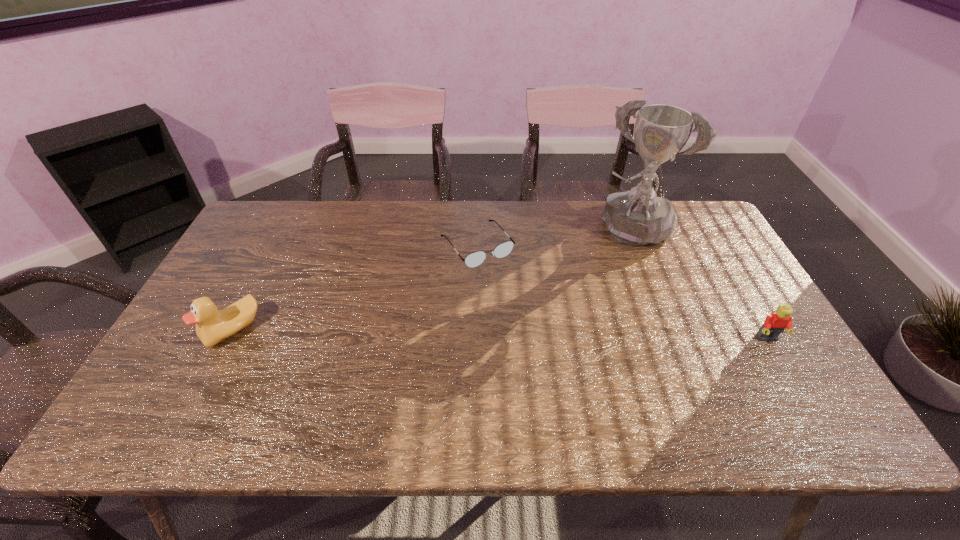
Find the location of a particular element. Image resolution: width=960 pixels, height=540 pixels. duck is located at coordinates (212, 326).

The image size is (960, 540). What are the coordinates of `the rightmost object` in the screenshot? It's located at (774, 324).

What are the coordinates of `spectacles` in the screenshot? It's located at (502, 250).

Where is `the third object from right to left`? the third object from right to left is located at coordinates (502, 250).

Find the location of a particular element. This screenshot has height=540, width=960. award is located at coordinates (638, 217).

In order to click on the tallest object in this screenshot , I will do `click(638, 217)`.

Locate an element on the screen. The image size is (960, 540). free space located 0.150m on the face of the Lego is located at coordinates (803, 399).

Where is `vacant area situated on the lenses of the spectacles`? The height and width of the screenshot is (540, 960). vacant area situated on the lenses of the spectacles is located at coordinates (522, 303).

Locate an element on the screen. The height and width of the screenshot is (540, 960). vacant region located 0.120m on the lenses of the spectacles is located at coordinates (515, 294).

This screenshot has height=540, width=960. Find the location of `free space located 0.160m on the lenses of the spectacles`. free space located 0.160m on the lenses of the spectacles is located at coordinates (522, 303).